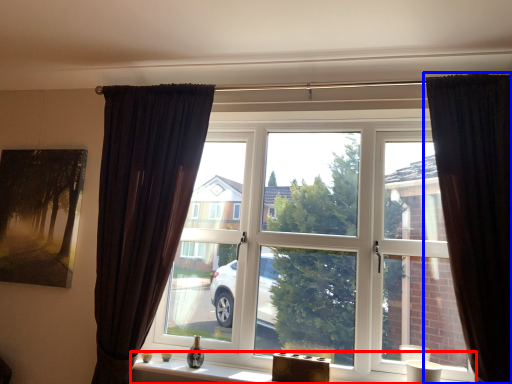
Question: Which of the following is the closest to the observer, window sill (highlighted by a red box) or curtain (highlighted by a blue box)?

Choices:
 (A) window sill
 (B) curtain

Answer: (B)